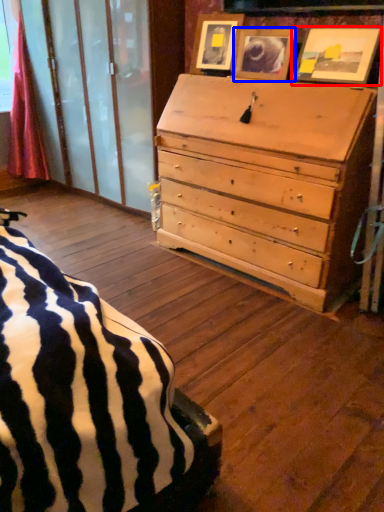
Question: Which object appears farthest to the camera in this image, picture frame (highlighted by a red box) or picture frame (highlighted by a blue box)?

Choices:
 (A) picture frame
 (B) picture frame

Answer: (B)